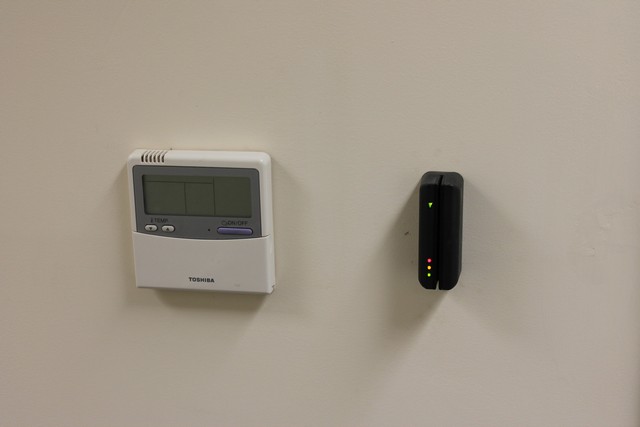
Identify the location of key card swipe. (438, 234).